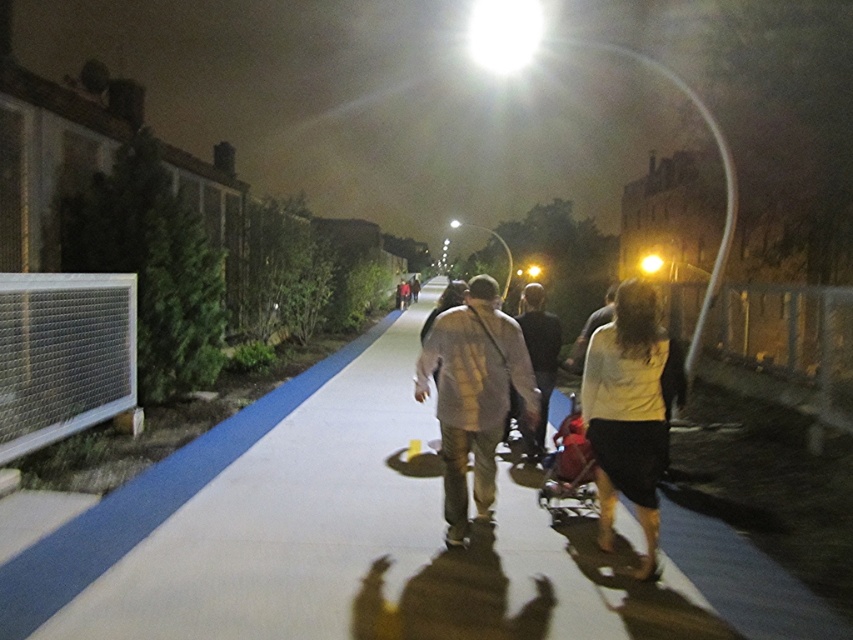
You are a pedestrian standing on the nighttime pathway. You see a white cotton shirt at center and a light brown leather jacket at center. Which clothing item is closer to the ground?

The white cotton shirt at center is below the light brown leather jacket at center, so it is closer to the ground.

You are a delivery person carrying a package that is 1 meter wide. You see the red fabric baby carriage at center and the light brown leather jacket at center on the pathway. Which object is narrow enough to allow you to pass safely with your package?

The red fabric baby carriage at center has a lesser width compared to the light brown leather jacket at center, so it is narrow enough to allow you to pass safely with your 1 meter wide package.